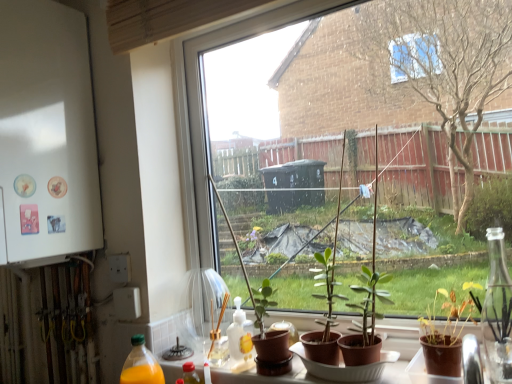
Question: Should I look upward or downward to see transparent glass window at center?

Choices:
 (A) up
 (B) down

Answer: (A)

Question: Considering the relative sizes of green matte plant at center, marked as the second houseplant in a right-to-left arrangement, and transparent glass window at center in the image provided, is green matte plant at center, marked as the second houseplant in a right-to-left arrangement, wider than transparent glass window at center?

Choices:
 (A) yes
 (B) no

Answer: (A)

Question: From the image's perspective, does green matte plant at center, the first houseplant viewed from the back, appear lower than transparent glass window at center?

Choices:
 (A) yes
 (B) no

Answer: (A)

Question: From a real-world perspective, is green matte plant at center, marked as the second houseplant in a right-to-left arrangement, located higher than transparent glass window at center?

Choices:
 (A) yes
 (B) no

Answer: (B)

Question: Does green matte plant at center, which ranks as the first houseplant in left-to-right order, appear on the left side of transparent glass window at center?

Choices:
 (A) yes
 (B) no

Answer: (A)

Question: Is green matte plant at center, which ranks as the first houseplant in left-to-right order, not near transparent glass window at center?

Choices:
 (A) no
 (B) yes

Answer: (A)

Question: Can you confirm if green matte plant at center, placed as the second houseplant when sorted from front to back, is thinner than transparent glass window at center?

Choices:
 (A) yes
 (B) no

Answer: (B)

Question: From the image's perspective, is white matte refrigerator at left located beneath green matte plant at center, which ranks as the first houseplant in left-to-right order?

Choices:
 (A) yes
 (B) no

Answer: (B)

Question: From a real-world perspective, is white matte refrigerator at left positioned over green matte plant at center, which ranks as the first houseplant in left-to-right order, based on gravity?

Choices:
 (A) no
 (B) yes

Answer: (B)

Question: Can you confirm if white matte refrigerator at left is positioned to the left of green matte plant at center, marked as the second houseplant in a right-to-left arrangement?

Choices:
 (A) no
 (B) yes

Answer: (B)

Question: Would you say white matte refrigerator at left is outside green matte plant at center, which ranks as the first houseplant in left-to-right order?

Choices:
 (A) no
 (B) yes

Answer: (B)

Question: Considering the relative sizes of white matte refrigerator at left and green matte plant at center, placed as the second houseplant when sorted from front to back, in the image provided, is white matte refrigerator at left bigger than green matte plant at center, placed as the second houseplant when sorted from front to back,?

Choices:
 (A) no
 (B) yes

Answer: (B)

Question: Is white matte refrigerator at left wider than green matte plant at center, placed as the second houseplant when sorted from front to back?

Choices:
 (A) yes
 (B) no

Answer: (A)

Question: Can you confirm if brown matte pot at lower right, which is counted as the 1th houseplant, starting from the right, is thinner than green matte plant at center, marked as the second houseplant in a right-to-left arrangement?

Choices:
 (A) no
 (B) yes

Answer: (A)